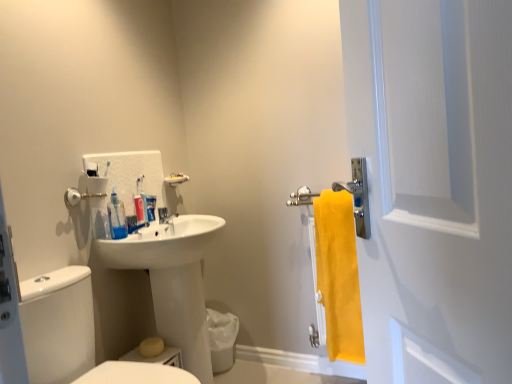
The image size is (512, 384). I want to click on vacant space in front of translucent plastic toothpaste tube at upper center, so click(138, 237).